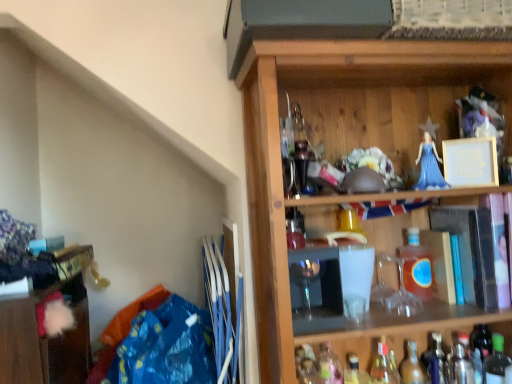
Image resolution: width=512 pixels, height=384 pixels. Describe the element at coordinates (412, 366) in the screenshot. I see `translucent glass bottle at lower right, the fourth bottle in the right-to-left sequence` at that location.

Where is `wooden cabinet at lower left`? wooden cabinet at lower left is located at coordinates (46, 336).

Describe the element at coordinates (46, 336) in the screenshot. This screenshot has width=512, height=384. I see `wooden cabinet at lower left` at that location.

Locate an element on the screen. translucent amber glass bottle at center-right, which is counted as the fifth bottle, starting from the right is located at coordinates (416, 265).

What are the coordinates of `translucent glass bottle at lower right, positioned as the sixth bottle in left-to-right order` in the screenshot? It's located at (x=435, y=359).

Identify the location of translucent glass bottle at lower right, which ranks as the fifth bottle in left-to-right order. (412, 366).

Can you confirm if translucent amber glass bottle at center-right, which is counted as the fifth bottle, starting from the right, is taller than translucent glass bottle at lower right, marked as the sixth bottle in a right-to-left arrangement?

Yes, translucent amber glass bottle at center-right, which is counted as the fifth bottle, starting from the right, is taller than translucent glass bottle at lower right, marked as the sixth bottle in a right-to-left arrangement.

Which is less distant, (429, 259) or (381, 368)?

Point (429, 259).

Considering the positions of objects translucent amber glass bottle at center-right, which is counted as the fifth bottle, starting from the right, and translucent glass bottle at lower right, marked as the sixth bottle in a right-to-left arrangement, in the image provided, who is in front, translucent amber glass bottle at center-right, which is counted as the fifth bottle, starting from the right, or translucent glass bottle at lower right, marked as the sixth bottle in a right-to-left arrangement,?

translucent amber glass bottle at center-right, which is counted as the fifth bottle, starting from the right, is in front.

In the scene shown: From the image's perspective, which is above, translucent amber glass bottle at center-right, arranged as the 4th bottle when viewed from the left, or translucent glass bottle at lower right, which is the third bottle from left to right?

From the image's view, translucent amber glass bottle at center-right, arranged as the 4th bottle when viewed from the left, is above.

Is translucent glass bottle at lower right, which appears as the 7th bottle when viewed from the right, positioned far away from translucent glass bottle at lower right, which is the third bottle from left to right?

No, there isn't a large distance between translucent glass bottle at lower right, which appears as the 7th bottle when viewed from the right, and translucent glass bottle at lower right, which is the third bottle from left to right.

Is translucent glass bottle at lower right, which appears as the 7th bottle when viewed from the right, facing away from translucent glass bottle at lower right, marked as the sixth bottle in a right-to-left arrangement?

That's not correct — translucent glass bottle at lower right, which appears as the 7th bottle when viewed from the right, is not looking away from translucent glass bottle at lower right, marked as the sixth bottle in a right-to-left arrangement.

Is translucent glass bottle at lower right, which appears as the 7th bottle when viewed from the right, taller or shorter than translucent glass bottle at lower right, marked as the sixth bottle in a right-to-left arrangement?

translucent glass bottle at lower right, which appears as the 7th bottle when viewed from the right, is taller than translucent glass bottle at lower right, marked as the sixth bottle in a right-to-left arrangement.

From the image's perspective, which is below, translucent glass bottle at lower right, which appears as the 7th bottle when viewed from the right, or translucent glass bottle at lower right, marked as the sixth bottle in a right-to-left arrangement?

From the image's view, translucent glass bottle at lower right, which appears as the 7th bottle when viewed from the right, is below.

Could you tell me if translucent glass bottle at lower right, which ranks as the fifth bottle in left-to-right order, is facing translucent glass bottle at lower right, marked as the sixth bottle in a right-to-left arrangement?

No.

Is there a large distance between translucent glass bottle at lower right, which ranks as the fifth bottle in left-to-right order, and translucent glass bottle at lower right, which is the third bottle from left to right?

translucent glass bottle at lower right, which ranks as the fifth bottle in left-to-right order, is actually quite close to translucent glass bottle at lower right, which is the third bottle from left to right.

Based on the photo, is translucent glass bottle at lower right, marked as the sixth bottle in a right-to-left arrangement, completely or partially inside translucent glass bottle at lower right, the fourth bottle in the right-to-left sequence?

Definitely not — translucent glass bottle at lower right, marked as the sixth bottle in a right-to-left arrangement, is not inside translucent glass bottle at lower right, the fourth bottle in the right-to-left sequence.

From a real-world perspective, who is located higher, translucent glass bottle at lower right, the fourth bottle in the right-to-left sequence, or translucent glass bottle at lower right, which is the third bottle from left to right?

translucent glass bottle at lower right, the fourth bottle in the right-to-left sequence, is physically above.

In terms of height, does translucent glass bottle at lower center, acting as the eighth bottle starting from the right, look taller or shorter compared to wooden cabinet at lower left?

translucent glass bottle at lower center, acting as the eighth bottle starting from the right, is shorter than wooden cabinet at lower left.

Where is `cabinetry above the translucent glass bottle at lower center, the first bottle positioned from the left (from the image's perspective)`? Image resolution: width=512 pixels, height=384 pixels. cabinetry above the translucent glass bottle at lower center, the first bottle positioned from the left (from the image's perspective) is located at coordinates (46, 336).

Does translucent glass bottle at lower center, the first bottle positioned from the left, touch wooden cabinet at lower left?

No, translucent glass bottle at lower center, the first bottle positioned from the left, is not making contact with wooden cabinet at lower left.

Which is closer, (332, 356) or (75, 339)?

Point (332, 356) is positioned closer to the camera compared to point (75, 339).

Consider the image. Is translucent glass bottle at lower right, which ranks as the fifth bottle in left-to-right order, positioned with its back to translucent glass bottle at lower center, acting as the eighth bottle starting from the right?

No, translucent glass bottle at lower right, which ranks as the fifth bottle in left-to-right order,'s orientation is not away from translucent glass bottle at lower center, acting as the eighth bottle starting from the right.

Is translucent glass bottle at lower right, the fourth bottle in the right-to-left sequence, to the right of translucent glass bottle at lower center, the first bottle positioned from the left, from the viewer's perspective?

Yes.

From a real-world perspective, which bottle is the 4th one underneath the translucent glass bottle at lower center, the first bottle positioned from the left? Please provide its 2D coordinates.

[(412, 366)]

From the image's perspective, is translucent glass bottle at lower right, the fourth bottle in the right-to-left sequence, located above or below translucent glass bottle at lower center, the first bottle positioned from the left?

translucent glass bottle at lower right, the fourth bottle in the right-to-left sequence, is situated lower than translucent glass bottle at lower center, the first bottle positioned from the left, in the image.

Is translucent glass bottle at lower right, marked as the 3th bottle in a right-to-left arrangement, thinner than green glass bottle at lower right, placed as the eighth bottle when sorted from left to right?

Yes.

Between translucent glass bottle at lower right, marked as the 3th bottle in a right-to-left arrangement, and green glass bottle at lower right, placed as the eighth bottle when sorted from left to right, which one has larger size?

green glass bottle at lower right, placed as the eighth bottle when sorted from left to right, is bigger.

Is translucent glass bottle at lower right, marked as the 3th bottle in a right-to-left arrangement, not within green glass bottle at lower right, positioned as the 1th bottle in right-to-left order?

Yes, translucent glass bottle at lower right, marked as the 3th bottle in a right-to-left arrangement, is located beyond the bounds of green glass bottle at lower right, positioned as the 1th bottle in right-to-left order.

Is green glass bottle at lower right, positioned as the 1th bottle in right-to-left order, behind translucent glass bottle at lower right, positioned as the sixth bottle in left-to-right order?

No, green glass bottle at lower right, positioned as the 1th bottle in right-to-left order, is in front of translucent glass bottle at lower right, positioned as the sixth bottle in left-to-right order.

Is green glass bottle at lower right, positioned as the 1th bottle in right-to-left order, looking in the opposite direction of translucent glass bottle at lower right, positioned as the sixth bottle in left-to-right order?

That's not correct — green glass bottle at lower right, positioned as the 1th bottle in right-to-left order, is not looking away from translucent glass bottle at lower right, positioned as the sixth bottle in left-to-right order.

Based on their sizes in the image, would you say green glass bottle at lower right, positioned as the 1th bottle in right-to-left order, is bigger or smaller than translucent glass bottle at lower right, marked as the 3th bottle in a right-to-left arrangement?

green glass bottle at lower right, positioned as the 1th bottle in right-to-left order, is bigger than translucent glass bottle at lower right, marked as the 3th bottle in a right-to-left arrangement.

Is green glass bottle at lower right, placed as the eighth bottle when sorted from left to right, directly adjacent to translucent glass bottle at lower right, positioned as the sixth bottle in left-to-right order?

green glass bottle at lower right, placed as the eighth bottle when sorted from left to right, is not next to translucent glass bottle at lower right, positioned as the sixth bottle in left-to-right order, and they're not touching.

Starting from the translucent glass bottle at lower right, marked as the sixth bottle in a right-to-left arrangement, which bottle is the 1st one to the right? Please provide its 2D coordinates.

[(416, 265)]

Starting from the translucent glass bottle at lower right, which is the third bottle from left to right, which bottle is the 1st one to the left? Please provide its 2D coordinates.

[(354, 371)]

Which object lies further to the anchor point translucent glass bottle at lower right, marked as the 3th bottle in a right-to-left arrangement, wooden cabinet at lower left or metallic silver shaker at lower right, which appears as the second bottle when viewed from the right?

wooden cabinet at lower left is further to translucent glass bottle at lower right, marked as the 3th bottle in a right-to-left arrangement.

Based on their spatial positions, is translucent glass bottle at lower center, acting as the eighth bottle starting from the right, or translucent glass bottle at lower right, which ranks as the 2th bottle in left-to-right order, closer to translucent glass bottle at lower right, which is the third bottle from left to right?

Based on the image, translucent glass bottle at lower right, which ranks as the 2th bottle in left-to-right order, appears to be nearer to translucent glass bottle at lower right, which is the third bottle from left to right.

Looking at the image, which one is located further to wooden shelf at upper right, translucent glass bottle at lower right, which ranks as the 2th bottle in left-to-right order, or translucent glass bottle at lower right, marked as the 3th bottle in a right-to-left arrangement?

translucent glass bottle at lower right, marked as the 3th bottle in a right-to-left arrangement, is positioned further to the anchor wooden shelf at upper right.

From the picture: Based on their spatial positions, is translucent glass bottle at lower right, positioned as the sixth bottle in left-to-right order, or translucent glass bottle at lower right, the fourth bottle in the right-to-left sequence, closer to translucent glass bottle at lower right, which is the third bottle from left to right?

translucent glass bottle at lower right, the fourth bottle in the right-to-left sequence, is positioned closer to the anchor translucent glass bottle at lower right, which is the third bottle from left to right.

When comparing their distances from translucent amber glass bottle at center-right, which is counted as the fifth bottle, starting from the right, does translucent glass bottle at lower center, the first bottle positioned from the left, or green glass bottle at lower right, placed as the eighth bottle when sorted from left to right, seem further?

translucent glass bottle at lower center, the first bottle positioned from the left, is further to translucent amber glass bottle at center-right, which is counted as the fifth bottle, starting from the right.

From the image, which object appears to be nearer to wooden cabinet at lower left, wooden shelf at upper right or translucent glass bottle at lower right, marked as the sixth bottle in a right-to-left arrangement?

Among the two, wooden shelf at upper right is located nearer to wooden cabinet at lower left.

From the image, which object appears to be nearer to translucent amber glass bottle at center-right, arranged as the 4th bottle when viewed from the left, wooden cabinet at lower left or green glass bottle at lower right, placed as the eighth bottle when sorted from left to right?

green glass bottle at lower right, placed as the eighth bottle when sorted from left to right, is positioned closer to the anchor translucent amber glass bottle at center-right, arranged as the 4th bottle when viewed from the left.

Looking at the image, which one is located closer to translucent glass bottle at lower right, the fourth bottle in the right-to-left sequence, wooden shelf at upper right or wooden cabinet at lower left?

wooden shelf at upper right is positioned closer to the anchor translucent glass bottle at lower right, the fourth bottle in the right-to-left sequence.

Image resolution: width=512 pixels, height=384 pixels. Find the location of `shelf situated between wooden cabinet at lower left and green glass bottle at lower right, placed as the eighth bottle when sorted from left to right, from left to right`. shelf situated between wooden cabinet at lower left and green glass bottle at lower right, placed as the eighth bottle when sorted from left to right, from left to right is located at coordinates (343, 134).

Locate an element on the screen. bottle between translucent glass bottle at lower right, marked as the 3th bottle in a right-to-left arrangement, and green glass bottle at lower right, placed as the eighth bottle when sorted from left to right, in the horizontal direction is located at coordinates (459, 363).

What are the coordinates of `shelf located between translucent glass bottle at lower center, acting as the eighth bottle starting from the right, and green glass bottle at lower right, placed as the eighth bottle when sorted from left to right, in the left-right direction` in the screenshot? It's located at (343, 134).

Image resolution: width=512 pixels, height=384 pixels. Identify the location of bottle between wooden shelf at upper right and green glass bottle at lower right, placed as the eighth bottle when sorted from left to right, in the vertical direction. (416, 265).